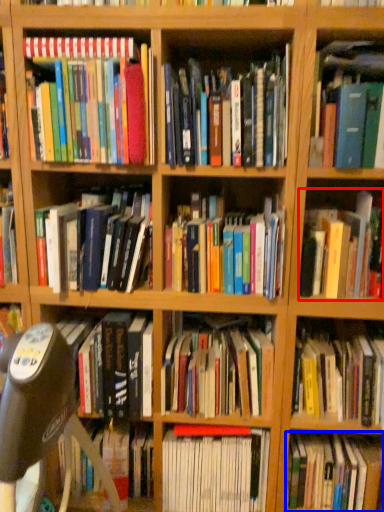
Question: Which object appears farthest to the camera in this image, book (highlighted by a red box) or book (highlighted by a blue box)?

Choices:
 (A) book
 (B) book

Answer: (B)